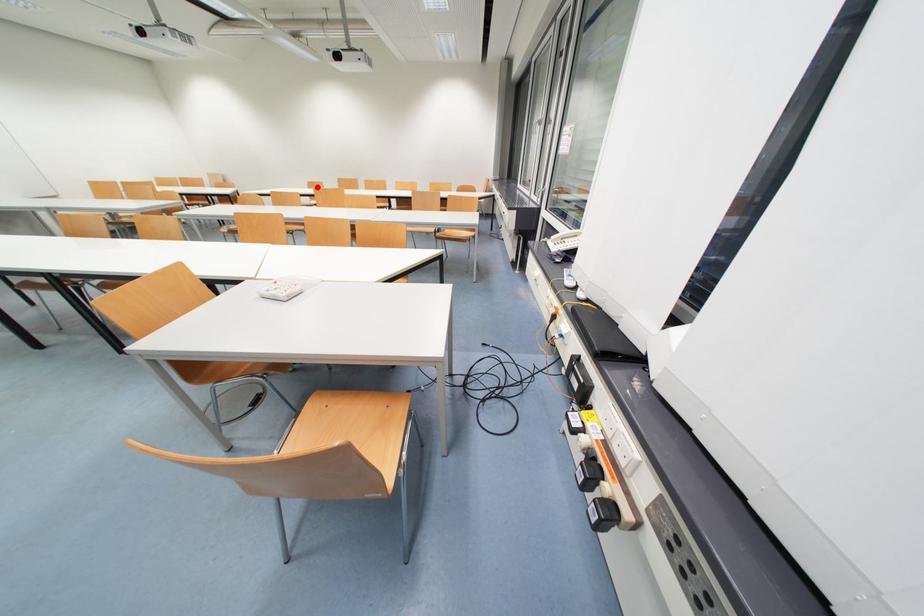
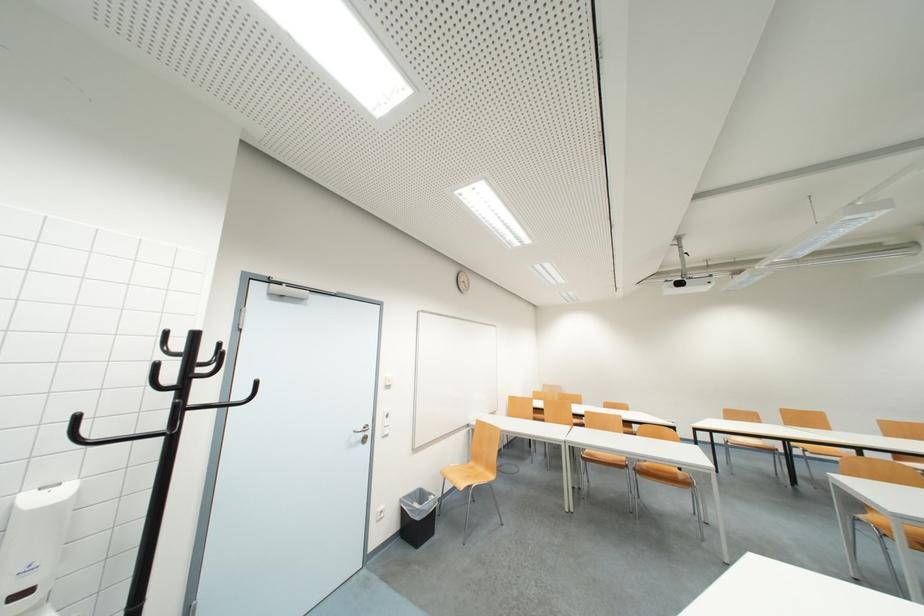
Where in the second image is the point corresponding to the highlighted location from the first image?

(736, 416)